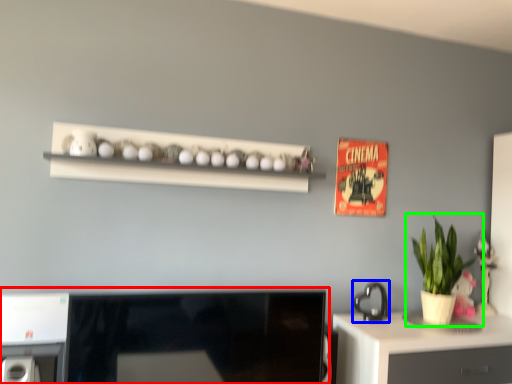
Question: Based on their relative distances, which object is nearer to desktop (highlighted by a red box)? Choose from appliance (highlighted by a blue box) and houseplant (highlighted by a green box).

Choices:
 (A) appliance
 (B) houseplant

Answer: (A)